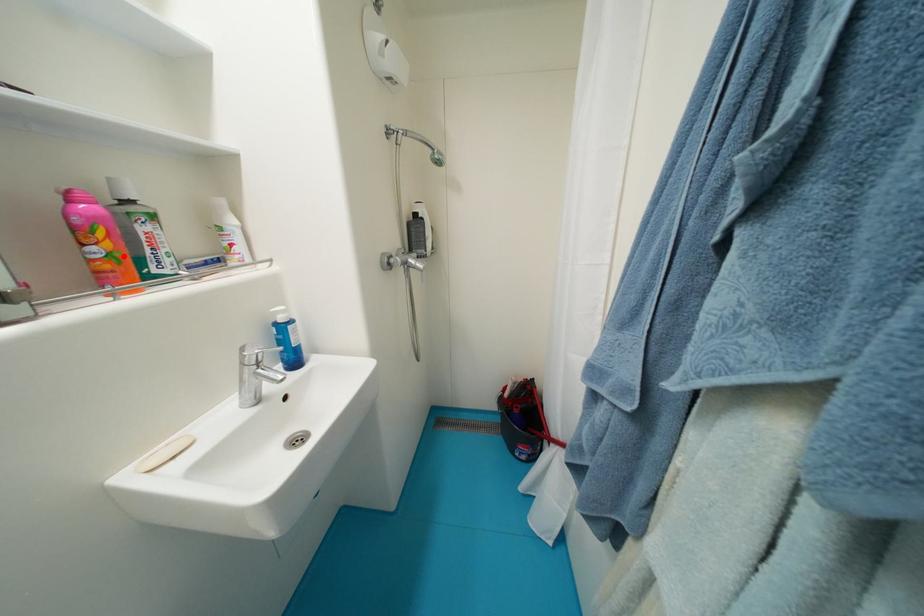
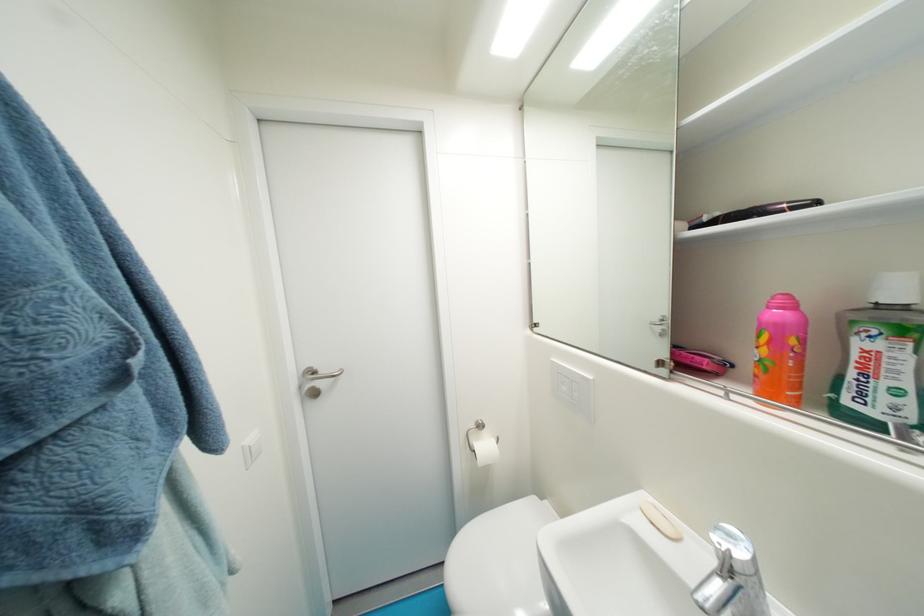
In the second image, find the point that corresponds to the highlighted location in the first image.

(774, 363)